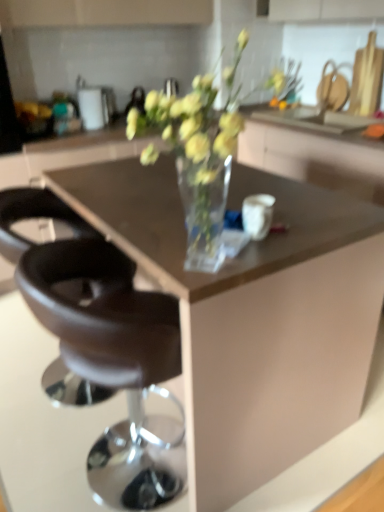
The width and height of the screenshot is (384, 512). Identify the location of free space above brown leather stool at center, the first chair positioned from the front (from a real-world perspective). (140, 234).